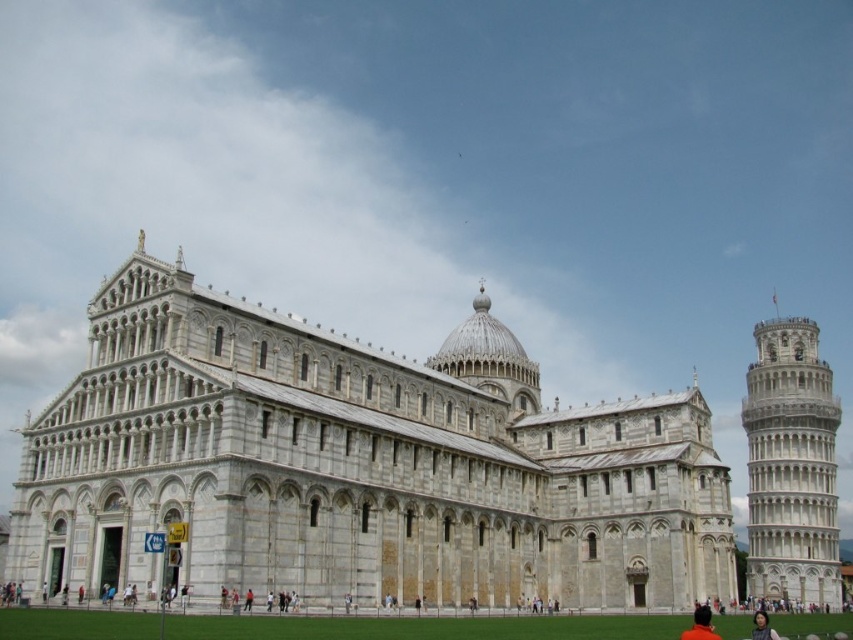
Consider the image. You are standing in the Piazza dei Miracoli and want to take a photo that includes both the Leaning Tower of Pisa and the Duomo. You notice two points marked in the scene at coordinates point (x=422, y=380) and point (x=759, y=625). Which point should you stand closer to ensure both landmarks are in frame?

You should stand closer to point (x=422, y=380) because it is closer to the camera, allowing both the Leaning Tower of Pisa and the Duomo to be in frame simultaneously.

You are a tourist visiting the Piazza dei Miracoli. You notice the white marble tower at right and the smooth skin face at lower right in the scene. Which object appears bigger in the image?

The white marble tower at right is larger in size than the smooth skin face at lower right, so the white marble tower at right appears bigger in the image.